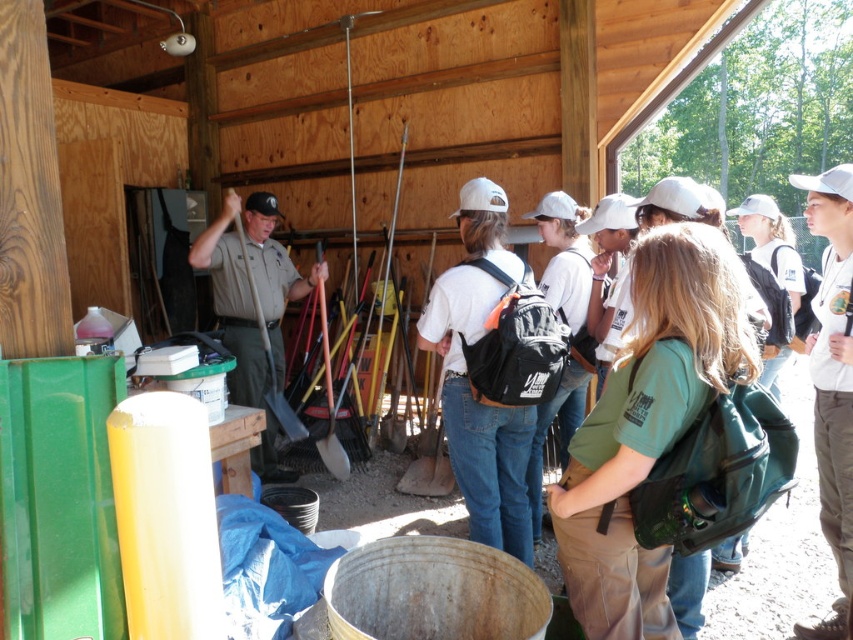
Question: Which of the following is the closest to the observer?

Choices:
 (A) khaki uniform at center
 (B) brushed metal shovel at center
 (C) gray wooden shovel at center
 (D) green fabric backpack at center

Answer: (D)

Question: Which object appears closest to the camera in this image?

Choices:
 (A) brushed metal shovel at center
 (B) khaki uniform at center
 (C) green fabric backpack at center

Answer: (C)

Question: Does green fabric backpack at center have a larger size compared to khaki uniform at center?

Choices:
 (A) yes
 (B) no

Answer: (B)

Question: Does khaki uniform at center have a larger size compared to gray wooden shovel at center?

Choices:
 (A) yes
 (B) no

Answer: (A)

Question: Based on their relative distances, which object is farther from the khaki uniform at center?

Choices:
 (A) gray wooden shovel at center
 (B) green fabric backpack at center

Answer: (B)

Question: Is green fabric backpack at center above brushed metal shovel at center?

Choices:
 (A) no
 (B) yes

Answer: (B)